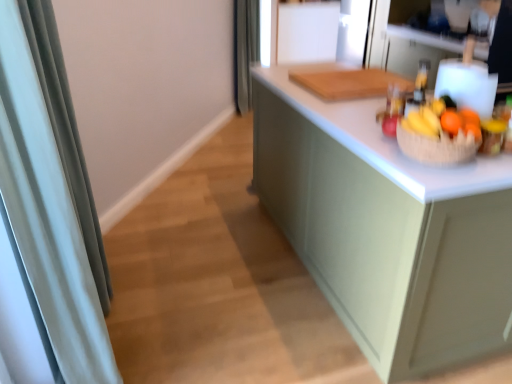
Where is `free spot above brown woven basket at right (from a real-world perspective)`? The height and width of the screenshot is (384, 512). free spot above brown woven basket at right (from a real-world perspective) is located at coordinates (445, 124).